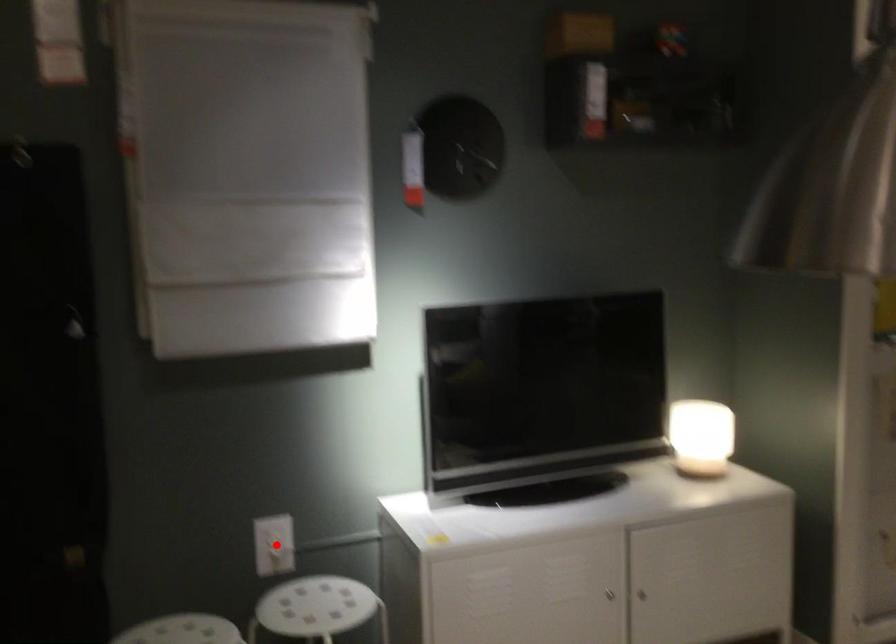
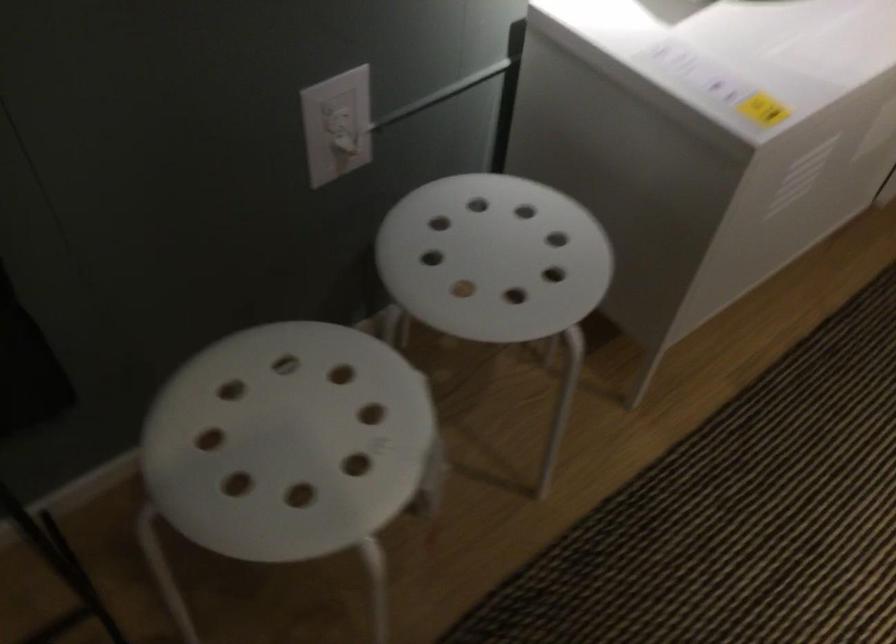
Question: A red point is marked in image1. In image2, is the corresponding 3D point closer to the camera or farther? Reply with the corresponding letter.

Choices:
 (A) The corresponding 3D point is closer.
 (B) The corresponding 3D point is farther.

Answer: (A)